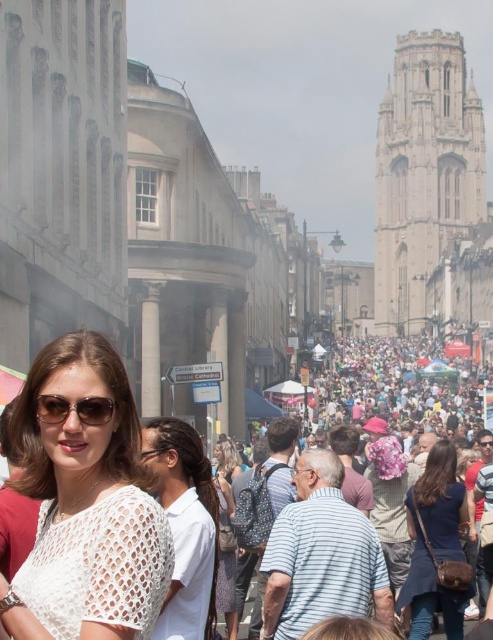
You are a fashion designer observing a woman wearing a white crochet top at center and transparent plastic glasses at center in a busy street scene. Which item is wider when viewed from the front?

The white crochet top at center is wider than the transparent plastic glasses at center.

You are standing in the middle of a crowded street in Bristol, England. You notice a stone tower at upper right and sunglasses at center. How far apart are these two landmarks from each other?

The stone tower at upper right is 143.66 meters from the sunglasses at center.